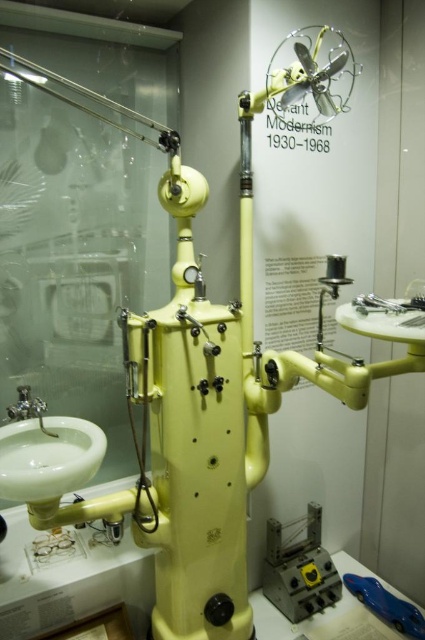
Who is higher up, white glossy sink at lower left or blue plastic toy car at lower right?

white glossy sink at lower left

Image resolution: width=425 pixels, height=640 pixels. I want to click on white glossy sink at lower left, so click(48, 458).

Can you confirm if blue plastic toy car at lower right is taller than brushed metal faucet at lower left?

No, blue plastic toy car at lower right is not taller than brushed metal faucet at lower left.

Who is positioned more to the right, blue plastic toy car at lower right or brushed metal faucet at lower left?

From the viewer's perspective, blue plastic toy car at lower right appears more on the right side.

Describe the element at coordinates (387, 604) in the screenshot. I see `blue plastic toy car at lower right` at that location.

Identify the location of blue plastic toy car at lower right. (387, 604).

In the scene shown: Is the position of white glossy sink at lower left more distant than that of brushed metal faucet at lower left?

No, white glossy sink at lower left is in front of brushed metal faucet at lower left.

Is point (3, 448) positioned before point (22, 397)?

Yes.

This screenshot has height=640, width=425. What are the coordinates of `white glossy sink at lower left` in the screenshot? It's located at (48, 458).